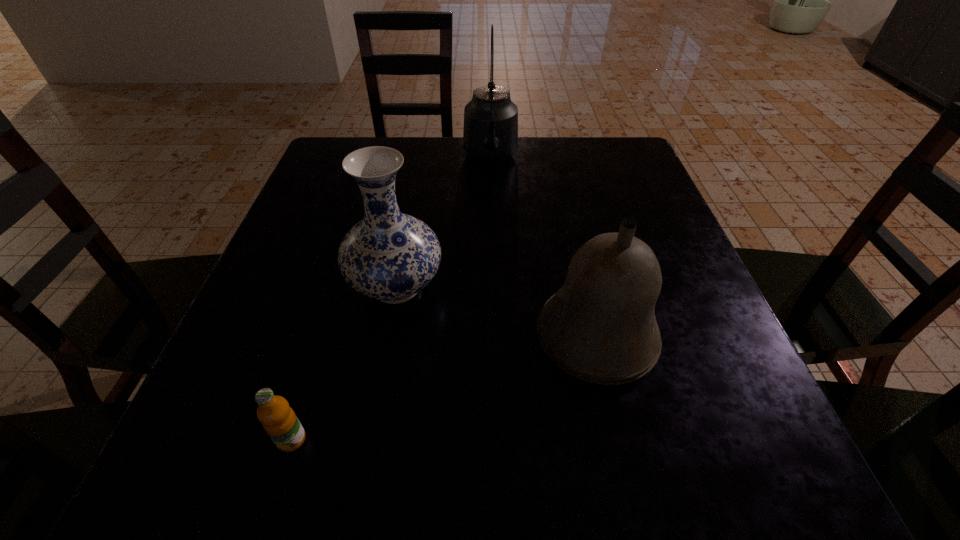
Identify the location of free area in between the kettle and the vase. Image resolution: width=960 pixels, height=540 pixels. (444, 222).

Find the location of a particular element. vacant area that lies between the vase and the kettle is located at coordinates (444, 222).

The image size is (960, 540). I want to click on empty location between the bell and the shortest object, so click(444, 388).

Find the location of a particular element. The image size is (960, 540). vacant area that lies between the orange juice and the bell is located at coordinates (444, 388).

Find the location of a particular element. free point between the kettle and the vase is located at coordinates click(x=444, y=222).

I want to click on vacant area that lies between the bell and the shortest object, so click(444, 388).

Identify the location of empty space between the vase and the nearest object. This screenshot has width=960, height=540. (344, 363).

The height and width of the screenshot is (540, 960). In order to click on free point between the bell and the kettle in this screenshot , I will do `click(543, 248)`.

The width and height of the screenshot is (960, 540). Identify the location of object that is the third nearest to the shortest object. (x=490, y=134).

Point out which object is positioned as the nearest to the orange juice. Please provide its 2D coordinates. Your answer should be formatted as a tuple, i.e. [(x, y)], where the tuple contains the x and y coordinates of a point satisfying the conditions above.

[(389, 256)]